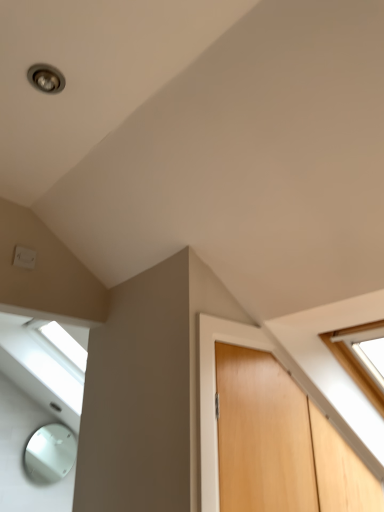
Locate an element on the screen. white plastic electric outlet at upper left is located at coordinates (24, 257).

The image size is (384, 512). What do you see at coordinates (24, 257) in the screenshot? I see `white plastic electric outlet at upper left` at bounding box center [24, 257].

In order to face light brown wood door at center, should I rotate leftwards or rightwards?

A 17.351 degree turn to the right will do.

You are a GUI agent. You are given a task and a screenshot of the screen. Output one action in this format:
    pyautogui.click(x=<x>, y=<y>)
    Task: Click on the light brown wood door at center
    Image resolution: width=384 pixels, height=512 pixels.
    Given the screenshot: What is the action you would take?
    pyautogui.click(x=263, y=435)

This screenshot has width=384, height=512. What do you see at coordinates (263, 435) in the screenshot?
I see `light brown wood door at center` at bounding box center [263, 435].

This screenshot has width=384, height=512. I want to click on white plastic electric outlet at upper left, so click(x=24, y=257).

Considering the relative positions of light brown wood door at center and white plastic electric outlet at upper left in the image provided, is light brown wood door at center to the left or to the right of white plastic electric outlet at upper left?

Based on their positions, light brown wood door at center is located to the right of white plastic electric outlet at upper left.

Considering their positions, is light brown wood door at center located in front of or behind white plastic electric outlet at upper left?

light brown wood door at center is in front of white plastic electric outlet at upper left.

Which is nearer, (x=245, y=498) or (x=30, y=264)?

Point (x=245, y=498)

From the image's perspective, between light brown wood door at center and white plastic electric outlet at upper left, who is located below?

light brown wood door at center.

From a real-world perspective, which is physically below, light brown wood door at center or white plastic electric outlet at upper left?

In real-world perspective, light brown wood door at center is lower.

Which of these two, light brown wood door at center or white plastic electric outlet at upper left, is wider?

light brown wood door at center.

Considering the relative sizes of light brown wood door at center and white plastic electric outlet at upper left in the image provided, is light brown wood door at center shorter than white plastic electric outlet at upper left?

Incorrect, the height of light brown wood door at center does not fall short of that of white plastic electric outlet at upper left.

Which of these two, light brown wood door at center or white plastic electric outlet at upper left, is smaller?

With smaller size is white plastic electric outlet at upper left.

Is light brown wood door at center inside the boundaries of white plastic electric outlet at upper left, or outside?

light brown wood door at center cannot be found inside white plastic electric outlet at upper left.

Are light brown wood door at center and white plastic electric outlet at upper left located far from each other?

Yes, light brown wood door at center and white plastic electric outlet at upper left are quite far apart.

Is light brown wood door at center facing away from white plastic electric outlet at upper left?

No.

How far apart are light brown wood door at center and white plastic electric outlet at upper left?

light brown wood door at center is 3.66 feet from white plastic electric outlet at upper left.

You are a GUI agent. You are given a task and a screenshot of the screen. Output one action in this format:
    pyautogui.click(x=<x>, y=<y>)
    Task: Click on the door that is under the white plastic electric outlet at upper left (from a real-world perspective)
    This screenshot has width=384, height=512.
    Given the screenshot: What is the action you would take?
    pyautogui.click(x=263, y=435)

Does white plastic electric outlet at upper left appear on the right side of light brown wood door at center?

No, white plastic electric outlet at upper left is not to the right of light brown wood door at center.

Relative to light brown wood door at center, is white plastic electric outlet at upper left in front or behind?

white plastic electric outlet at upper left is behind light brown wood door at center.

Which is closer, (33, 264) or (290, 477)?

Point (33, 264) is positioned farther from the camera compared to point (290, 477).

From the image's perspective, is white plastic electric outlet at upper left above or below light brown wood door at center?

white plastic electric outlet at upper left is situated higher than light brown wood door at center in the image.

From a real-world perspective, which object rests below the other?

light brown wood door at center.

Looking at their sizes, would you say white plastic electric outlet at upper left is wider or thinner than light brown wood door at center?

white plastic electric outlet at upper left is thinner than light brown wood door at center.

Which of these two, white plastic electric outlet at upper left or light brown wood door at center, stands shorter?

With less height is white plastic electric outlet at upper left.

Based on their sizes in the image, would you say white plastic electric outlet at upper left is bigger or smaller than light brown wood door at center?

Clearly, white plastic electric outlet at upper left is smaller in size than light brown wood door at center.

Which is correct: white plastic electric outlet at upper left is inside light brown wood door at center, or outside of it?

white plastic electric outlet at upper left is not enclosed by light brown wood door at center.

Is white plastic electric outlet at upper left beside light brown wood door at center?

No.

Is white plastic electric outlet at upper left aimed at light brown wood door at center?

No.

What's the angular difference between white plastic electric outlet at upper left and light brown wood door at center's facing directions?

They differ by 0.00222 degrees in their facing directions.

Measure the distance between white plastic electric outlet at upper left and light brown wood door at center.

The distance of white plastic electric outlet at upper left from light brown wood door at center is 3.66 feet.

Where is `electric outlet lying on the left of light brown wood door at center`? electric outlet lying on the left of light brown wood door at center is located at coordinates (24, 257).

Find the location of a particular element. The height and width of the screenshot is (512, 384). electric outlet that is above the light brown wood door at center (from the image's perspective) is located at coordinates pos(24,257).

Identify the location of electric outlet behind the light brown wood door at center. This screenshot has height=512, width=384. (24, 257).